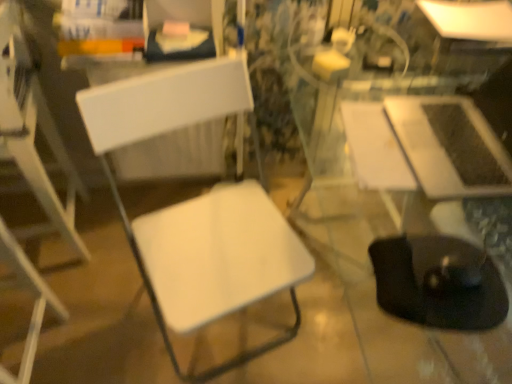
Question: Is white matte chair at left, the 2th chair from the left, in front of or behind white glossy table at upper right, which is the 1th table in top-to-bottom order, in the image?

Choices:
 (A) front
 (B) behind

Answer: (A)

Question: In the image, is white matte chair at left, the 2th chair from the left, on the left side or the right side of white glossy table at upper right, acting as the 1th table starting from the back?

Choices:
 (A) left
 (B) right

Answer: (A)

Question: Estimate the real-world distances between objects in this image. Which object is closer to the white glossy table at upper right, which is the 1th table in top-to-bottom order?

Choices:
 (A) white plastic chair at left, the 1th chair when ordered from left to right
 (B) white matte chair at left, marked as the 1th chair in a right-to-left arrangement
 (C) black rubber swivel chair at lower right
 (D) satin silver laptop at right, placed as the first table when sorted from front to back

Answer: (D)

Question: Which object is the closest to the white matte chair at left, the 2th chair from the left?

Choices:
 (A) white glossy table at upper right, acting as the 1th table starting from the back
 (B) satin silver laptop at right, placed as the first table when sorted from front to back
 (C) black rubber swivel chair at lower right
 (D) white plastic chair at left, the 1th chair when ordered from left to right

Answer: (C)